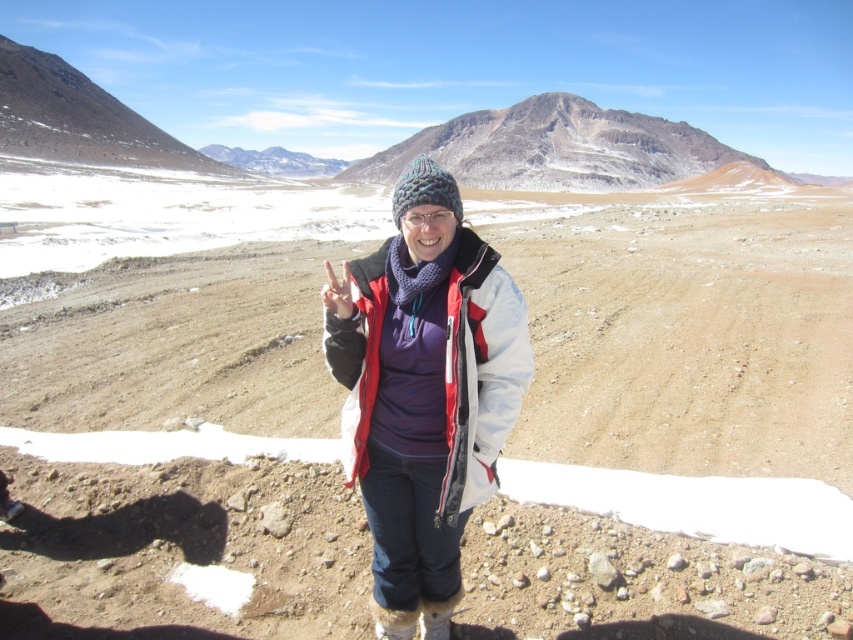
Question: Can you confirm if brown dirt at center is bigger than rugged stone mountain at center?

Choices:
 (A) no
 (B) yes

Answer: (A)

Question: Is brown dirt at center smaller than matte white jacket at center?

Choices:
 (A) no
 (B) yes

Answer: (A)

Question: Considering the relative positions of brown dirt at center and matte white jacket at center in the image provided, where is brown dirt at center located with respect to matte white jacket at center?

Choices:
 (A) above
 (B) below

Answer: (A)

Question: Which object is the closest to the rugged stone mountain at center?

Choices:
 (A) brown dirt at center
 (B) matte white jacket at center

Answer: (A)

Question: Estimate the real-world distances between objects in this image. Which object is farther from the matte white jacket at center?

Choices:
 (A) rugged stone mountain at center
 (B) brown dirt at center

Answer: (A)

Question: Based on their relative distances, which object is farther from the matte white jacket at center?

Choices:
 (A) rugged stone mountain at center
 (B) brown dirt at center

Answer: (A)